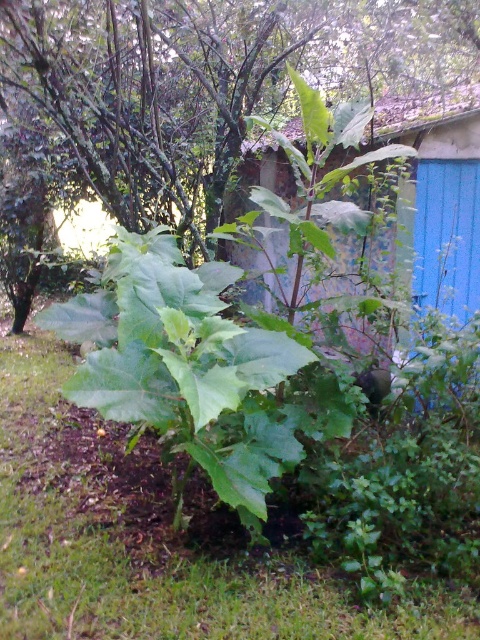
Is point (454, 19) positioned behind point (470, 196)?

Yes, point (454, 19) is farther from viewer.

What do you see at coordinates (202, 81) in the screenshot? This screenshot has height=640, width=480. I see `green leafy plant at center` at bounding box center [202, 81].

Find the location of a particular element. green leafy plant at center is located at coordinates (202, 81).

Which is above, green leafy grass at center or green leafy plant at center?

green leafy plant at center is higher up.

What do you see at coordinates (149, 541) in the screenshot? The width and height of the screenshot is (480, 640). I see `green leafy grass at center` at bounding box center [149, 541].

Does point (6, 524) lie behind point (132, 141)?

No, it is in front of (132, 141).

At what (x,y) coordinates should I click in order to perform the action: click on green leafy grass at center. Please return your answer as a coordinate pair (x, y). Looking at the image, I should click on (149, 541).

Is green leafy grass at center thinner than blue painted wood hut at center?

In fact, green leafy grass at center might be wider than blue painted wood hut at center.

Is point (327, 579) positioned behind point (435, 280)?

No, it is not.

Identify the location of green leafy grass at center. The height and width of the screenshot is (640, 480). (149, 541).